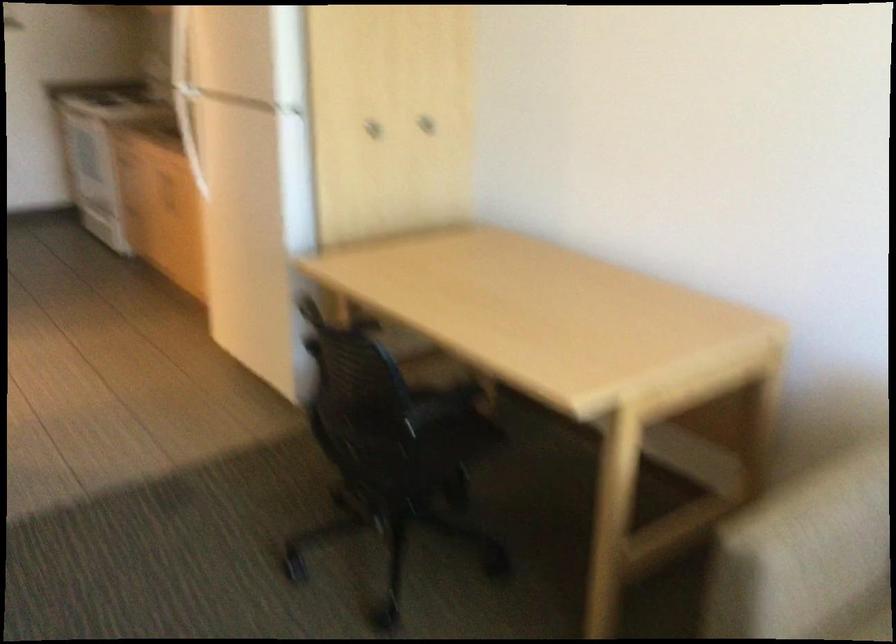
Where would you pull the refrigerator door handle? Please return your answer as a coordinate pair (x, y).

(185, 93)